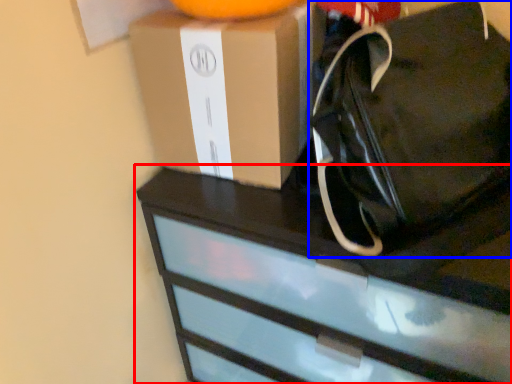
Question: Which of the following is the closest to the observer, chest of drawers (highlighted by a red box) or tote bag (highlighted by a blue box)?

Choices:
 (A) chest of drawers
 (B) tote bag

Answer: (B)